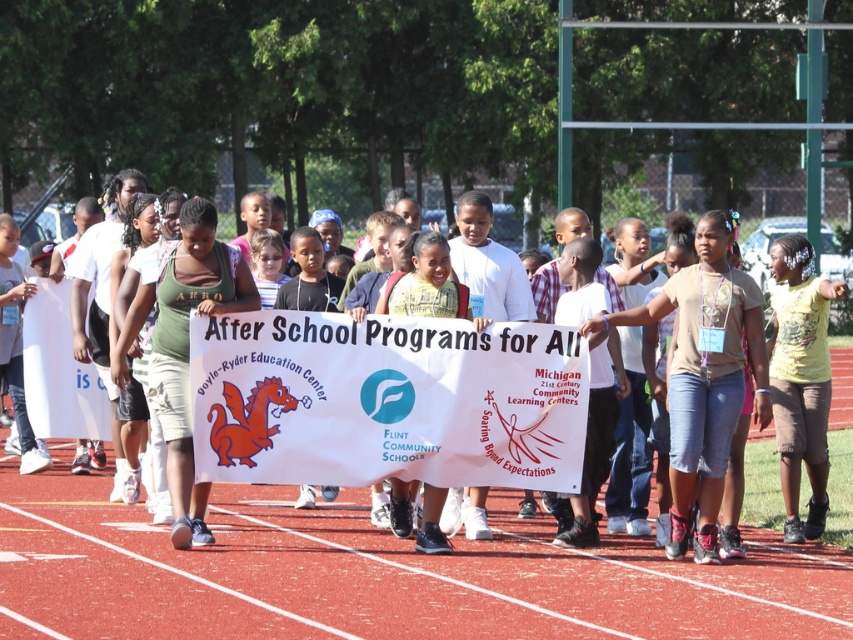
Question: Can you confirm if red rubber track at center is wider than yellow t-shirt at center?

Choices:
 (A) no
 (B) yes

Answer: (B)

Question: Among these points, which one is farthest from the camera?

Choices:
 (A) (776, 412)
 (B) (125, 620)
 (C) (637, 246)

Answer: (C)

Question: Does red rubber track at center have a lesser width compared to white paper sign at center?

Choices:
 (A) yes
 (B) no

Answer: (A)

Question: Estimate the real-world distances between objects in this image. Which object is farther from the red rubber track at center?

Choices:
 (A) yellow t-shirt at center
 (B) white paper sign at center

Answer: (B)

Question: Which point appears closest to the camera in this image?

Choices:
 (A) (769, 483)
 (B) (457, 621)
 (C) (780, 275)

Answer: (B)

Question: Is red rubber track at center below white paper sign at center?

Choices:
 (A) no
 (B) yes

Answer: (B)